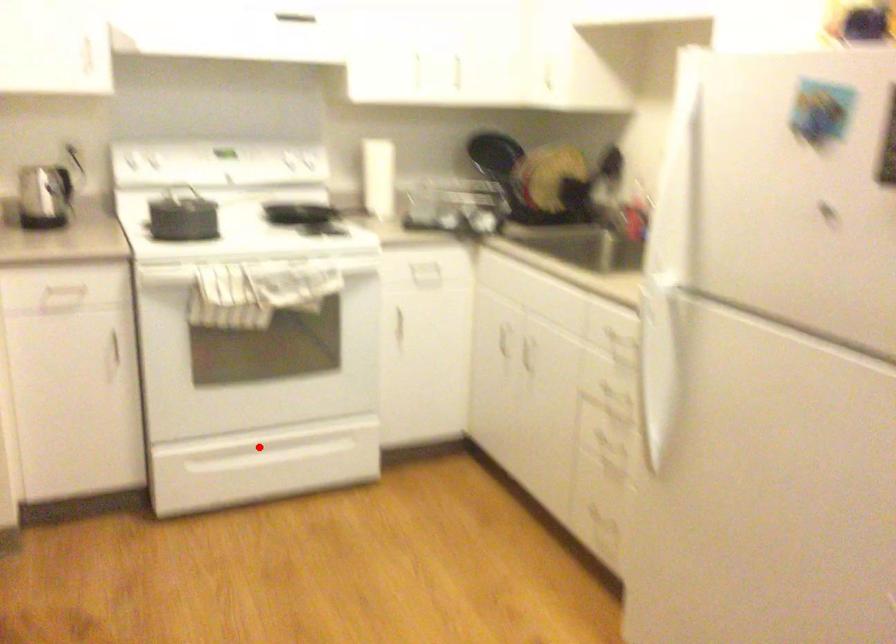
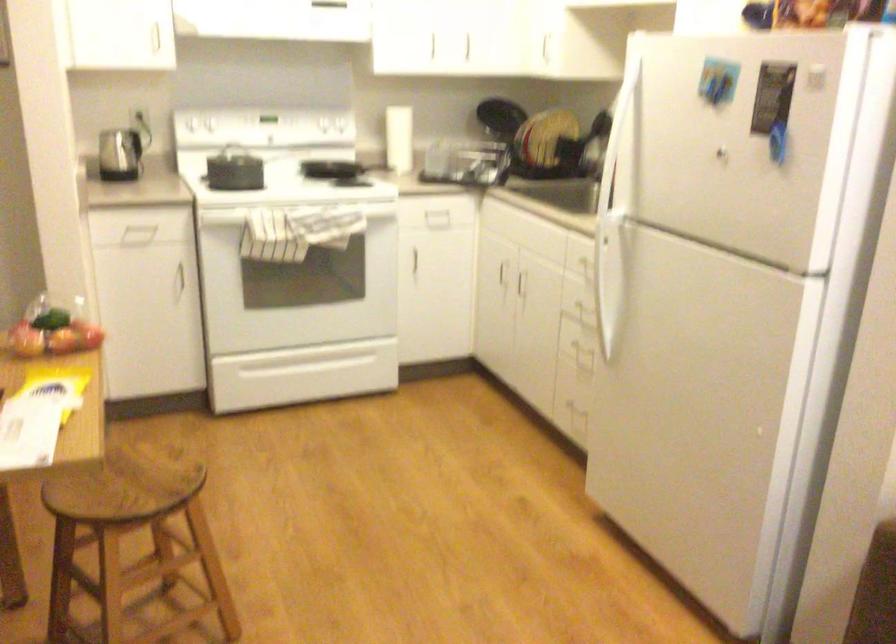
Where in the second image is the point corresponding to the highlighted location from the first image?

(298, 360)